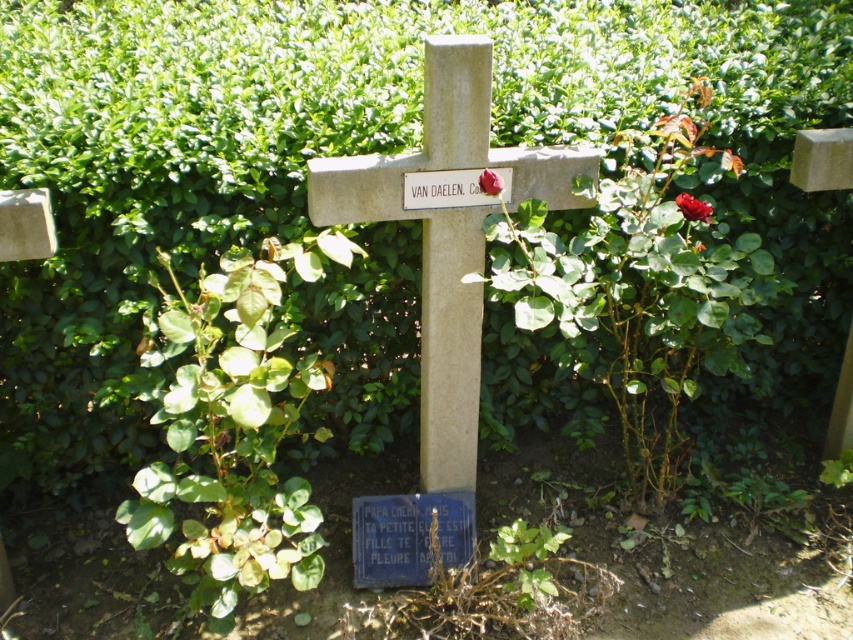
Who is positioned more to the left, blue polished stone plaque at center or glossy red rose at upper right?

From the viewer's perspective, blue polished stone plaque at center appears more on the left side.

Does blue polished stone plaque at center have a greater height compared to glossy red rose at upper right?

Indeed, blue polished stone plaque at center has a greater height compared to glossy red rose at upper right.

Between point (352, 540) and point (691, 211), which one is positioned behind?

Positioned behind is point (352, 540).

Where is `blue polished stone plaque at center`? This screenshot has width=853, height=640. blue polished stone plaque at center is located at coordinates (409, 536).

Can you confirm if blue polished stone plaque at center is bigger than red velvet rose at center?

Yes.

Can you confirm if blue polished stone plaque at center is wider than red velvet rose at center?

Yes, blue polished stone plaque at center is wider than red velvet rose at center.

Is point (426, 564) farther from viewer compared to point (490, 177)?

Yes, it is behind point (490, 177).

Locate an element on the screen. This screenshot has height=640, width=853. blue polished stone plaque at center is located at coordinates (409, 536).

Is smooth stone cross at center positioned in front of blue polished stone plaque at center?

That is True.

Who is positioned more to the left, smooth stone cross at center or blue polished stone plaque at center?

From the viewer's perspective, blue polished stone plaque at center appears more on the left side.

Does point (438, 392) come farther from viewer compared to point (355, 579)?

No, (438, 392) is in front of (355, 579).

I want to click on smooth stone cross at center, so click(x=440, y=291).